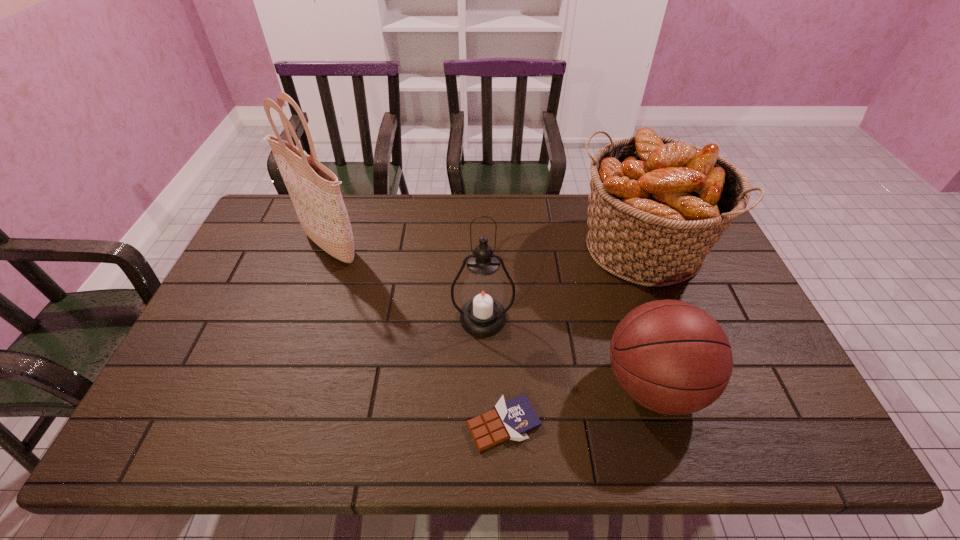
Find the location of a particular element. The width and height of the screenshot is (960, 540). vacant space that's between the leftmost object and the shortest object is located at coordinates (416, 335).

Where is `vacant space that's between the chocolate bar and the tallest object`? The height and width of the screenshot is (540, 960). vacant space that's between the chocolate bar and the tallest object is located at coordinates (416, 335).

The image size is (960, 540). Find the location of `object that is the nearest to the chocolate bar`. object that is the nearest to the chocolate bar is located at coordinates (671, 357).

The image size is (960, 540). What are the coordinates of `object identified as the second closest to the basket` in the screenshot? It's located at (483, 315).

Locate an element on the screen. vacant region that satisfies the following two spatial constraints: 1. on the front side of the basketball; 2. on the left side of the third nearest object is located at coordinates (483, 386).